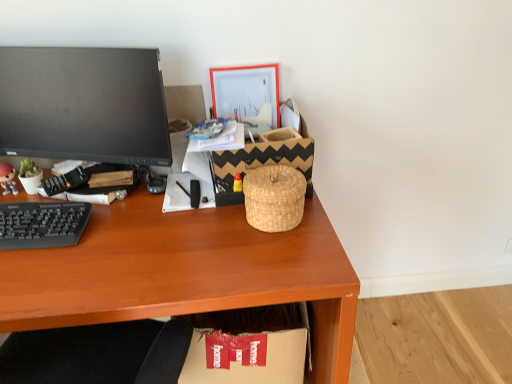
Question: Should I look upward or downward to see cardboard box at lower center?

Choices:
 (A) up
 (B) down

Answer: (B)

Question: From a real-world perspective, is woven natural basket at center on wooden desk at center?

Choices:
 (A) no
 (B) yes

Answer: (B)

Question: Is woven natural basket at center placed right next to wooden desk at center?

Choices:
 (A) yes
 (B) no

Answer: (B)

Question: Is woven natural basket at center turned away from wooden desk at center?

Choices:
 (A) yes
 (B) no

Answer: (B)

Question: From the image's perspective, is woven natural basket at center over wooden desk at center?

Choices:
 (A) yes
 (B) no

Answer: (A)

Question: Does woven natural basket at center have a greater width compared to wooden desk at center?

Choices:
 (A) no
 (B) yes

Answer: (A)

Question: Is woven natural basket at center far away from wooden desk at center?

Choices:
 (A) yes
 (B) no

Answer: (B)

Question: Is matte plastic picture frame at upper center far away from cardboard box at lower center?

Choices:
 (A) no
 (B) yes

Answer: (A)

Question: Is matte plastic picture frame at upper center to the left of cardboard box at lower center from the viewer's perspective?

Choices:
 (A) yes
 (B) no

Answer: (B)

Question: From the image's perspective, does matte plastic picture frame at upper center appear lower than cardboard box at lower center?

Choices:
 (A) yes
 (B) no

Answer: (B)

Question: Can you confirm if matte plastic picture frame at upper center is wider than cardboard box at lower center?

Choices:
 (A) no
 (B) yes

Answer: (A)

Question: Can we say matte plastic picture frame at upper center lies outside cardboard box at lower center?

Choices:
 (A) no
 (B) yes

Answer: (B)

Question: Could you tell me if matte plastic picture frame at upper center is facing cardboard box at lower center?

Choices:
 (A) yes
 (B) no

Answer: (B)

Question: From the image's perspective, is black plastic keyboard at left located above matte plastic figurine at left?

Choices:
 (A) yes
 (B) no

Answer: (B)